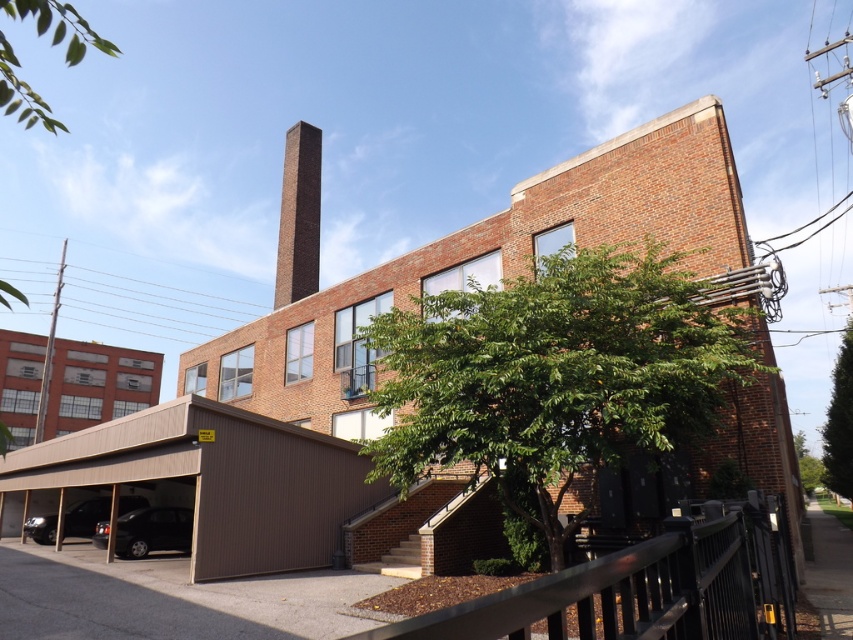
Question: Is green leafy tree at center bigger than green leafy tree at right?

Choices:
 (A) no
 (B) yes

Answer: (A)

Question: Based on their relative distances, which object is nearer to the brown brick building at center?

Choices:
 (A) black metal fence at lower right
 (B) green leafy tree at upper left

Answer: (B)

Question: Considering the relative positions of green leafy tree at center and green leafy tree at right in the image provided, where is green leafy tree at center located with respect to green leafy tree at right?

Choices:
 (A) above
 (B) below

Answer: (A)

Question: Is brick chimney at upper center wider than green leafy tree at upper left?

Choices:
 (A) no
 (B) yes

Answer: (A)

Question: Among these objects, which one is farthest from the camera?

Choices:
 (A) green leafy tree at center
 (B) black metal fence at lower right

Answer: (A)

Question: Among these objects, which one is farthest from the camera?

Choices:
 (A) brown brick building at center
 (B) black metal fence at lower right
 (C) green leafy tree at upper left

Answer: (A)